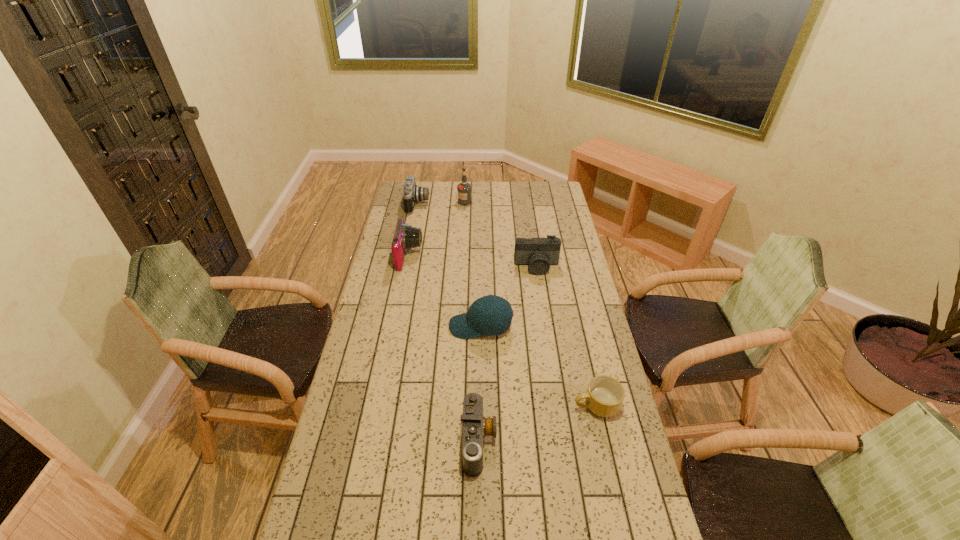
I want to click on vacant space located on the front-facing side of the third nearest object, so click(x=416, y=326).

At what (x,y) coordinates should I click in order to perform the action: click on vacant space located 0.290m on the front-facing side of the third nearest object. Please return your answer as a coordinate pair (x, y). Image resolution: width=960 pixels, height=540 pixels. Looking at the image, I should click on coord(374,326).

Locate an element on the screen. The image size is (960, 540). vacant region located 0.350m at the lens of the rightmost camera is located at coordinates (547, 336).

You are a GUI agent. You are given a task and a screenshot of the screen. Output one action in this format:
    pyautogui.click(x=<x>, y=<y>)
    Task: Click on the blank space located 0.300m on the lens of the sixth tallest object
    
    Given the screenshot: What is the action you would take?
    pyautogui.click(x=594, y=441)

The width and height of the screenshot is (960, 540). What are the coordinates of `free space located 0.400m on the side with the handle of the mug` in the screenshot? It's located at (450, 406).

The width and height of the screenshot is (960, 540). I want to click on free region located 0.180m on the side with the handle of the mug, so click(x=517, y=406).

Locate an element on the screen. vacant space located on the side with the handle of the mug is located at coordinates [x=460, y=406].

This screenshot has height=540, width=960. In order to click on vodka at the far edge in this screenshot , I will do [x=464, y=189].

Find the location of `camera positioned at the far edge`. camera positioned at the far edge is located at coordinates (412, 193).

Image resolution: width=960 pixels, height=540 pixels. In order to click on camera that is at the right edge in this screenshot , I will do `click(538, 253)`.